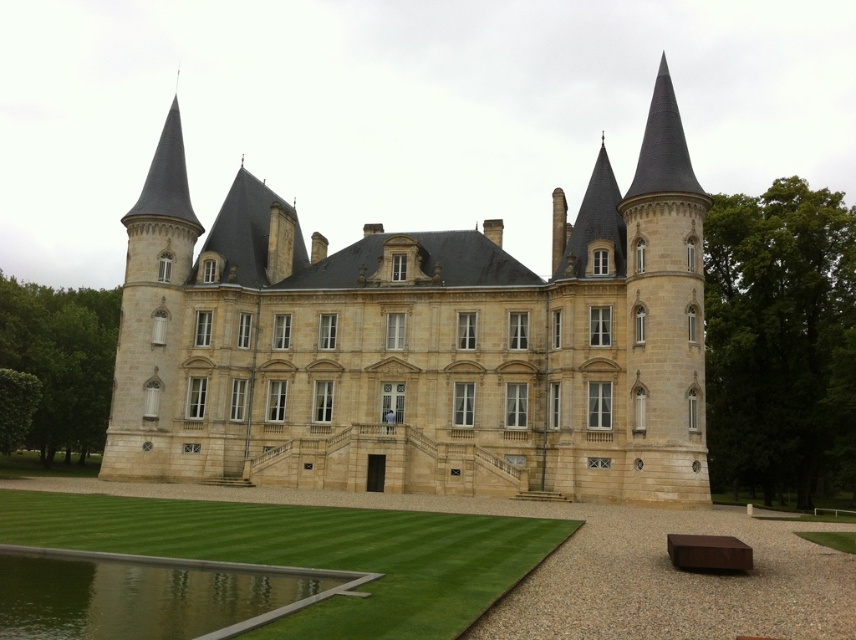
You are standing on the dock near the green reflective water at lower center. Looking up, can you see the beige stone castle at center in your line of sight?

Yes, the beige stone castle at center is above the green reflective water at lower center, so when standing on the dock near the green reflective water at lower center, you can see the beige stone castle at center in your line of sight.

You are standing in front of the historic chateau and want to walk towards the green grass lawn at lower center. However, there is a green reflective water at lower center in your path. Which object will you encounter first?

The green reflective water at lower center will be encountered first since it is smaller in size and positioned closer to the observer compared to the larger green grass lawn at lower center.

You are standing in front of the historic chateau and want to walk towards the green reflective water at lower center. Which direction should you move relative to the green grass lawn at lower center?

The green grass lawn at lower center is closer to you than the green reflective water at lower center. To reach the green reflective water at lower center, you should move away from the green grass lawn at lower center.